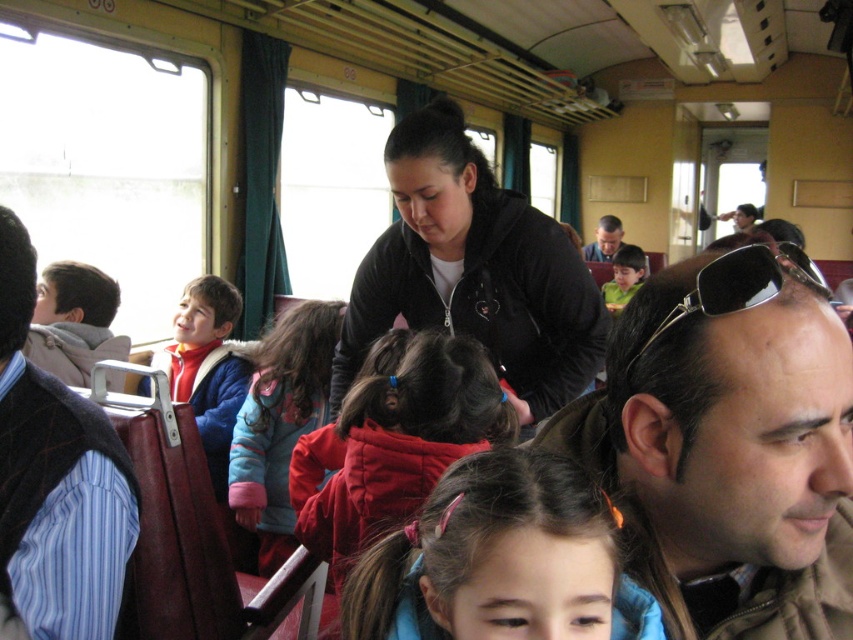
Question: Estimate the real-world distances between objects in this image. Which object is closer to the dark brown hair at center?

Choices:
 (A) blue fleece jacket at left
 (B) matte green shirt at center
 (C) fluffy pink jacket at center

Answer: (C)

Question: Which of the following is the closest to the observer?

Choices:
 (A) metallic reflective sunglasses at upper right
 (B) brown leather sunglasses at right
 (C) red puffer jacket at center
 (D) dark brown hair at center

Answer: (D)

Question: Is blue striped shirt at left positioned in front of metallic reflective sunglasses at upper right?

Choices:
 (A) no
 (B) yes

Answer: (A)

Question: Is dark brown hair at center to the right of blue fleece jacket at left from the viewer's perspective?

Choices:
 (A) no
 (B) yes

Answer: (B)

Question: Does brown leather sunglasses at right appear over black matte jacket at center?

Choices:
 (A) yes
 (B) no

Answer: (B)

Question: Which of the following is the closest to the observer?

Choices:
 (A) matte green shirt at center
 (B) fluffy pink jacket at center
 (C) blue fleece jacket at left

Answer: (B)